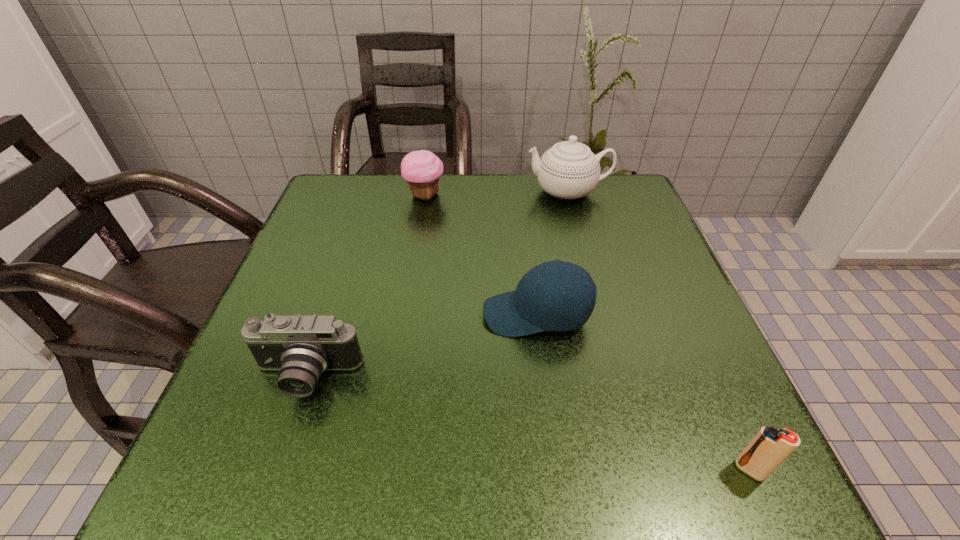
At what (x,y) coordinates should I click in order to perform the action: click on vacant position located on the left of the cupcake. Please return your answer as a coordinate pair (x, y). This screenshot has height=540, width=960. Looking at the image, I should click on (338, 195).

Where is `vacant area located on the front-facing side of the baseball cap`? This screenshot has height=540, width=960. vacant area located on the front-facing side of the baseball cap is located at coordinates (302, 314).

Locate an element on the screen. The image size is (960, 540). free space located on the front-facing side of the baseball cap is located at coordinates (414, 314).

Image resolution: width=960 pixels, height=540 pixels. In order to click on free space located 0.240m on the front-facing side of the baseball cap in this screenshot , I will do `click(355, 314)`.

This screenshot has height=540, width=960. What are the coordinates of `free spot located on the front-facing side of the camera` in the screenshot? It's located at [272, 482].

Identify the location of vacant position located 0.290m on the back of the rightmost object. This screenshot has height=540, width=960. (678, 309).

Find the location of `chinaware that is positioned at the far edge`. chinaware that is positioned at the far edge is located at coordinates (569, 170).

Image resolution: width=960 pixels, height=540 pixels. In order to click on cupcake located at the far edge in this screenshot , I will do `click(422, 169)`.

Find the location of a particular element. object that is at the near edge is located at coordinates (770, 447).

Where is `object at the left edge`? This screenshot has height=540, width=960. object at the left edge is located at coordinates (302, 347).